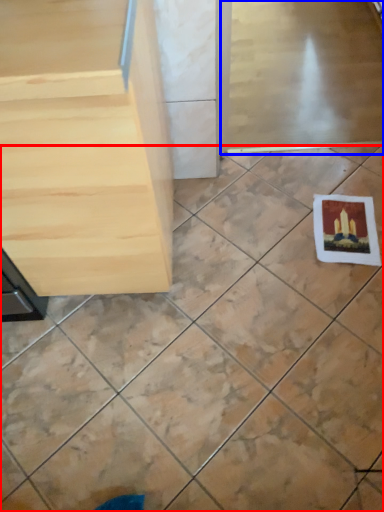
Question: Which object appears farthest to the camera in this image, ceramic tile (highlighted by a red box) or screen door (highlighted by a blue box)?

Choices:
 (A) ceramic tile
 (B) screen door

Answer: (B)